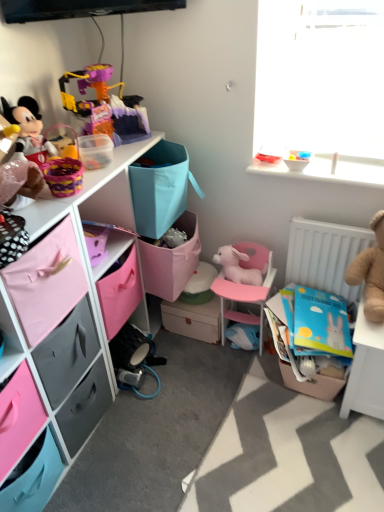
Locate an element on the screen. The image size is (384, 512). vacant space in front of pink plastic chair at center is located at coordinates (220, 380).